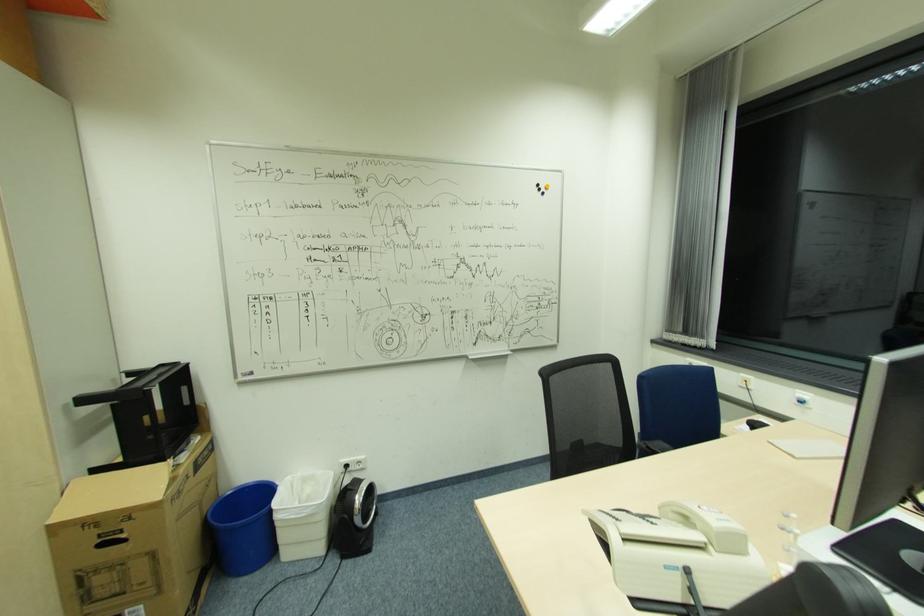
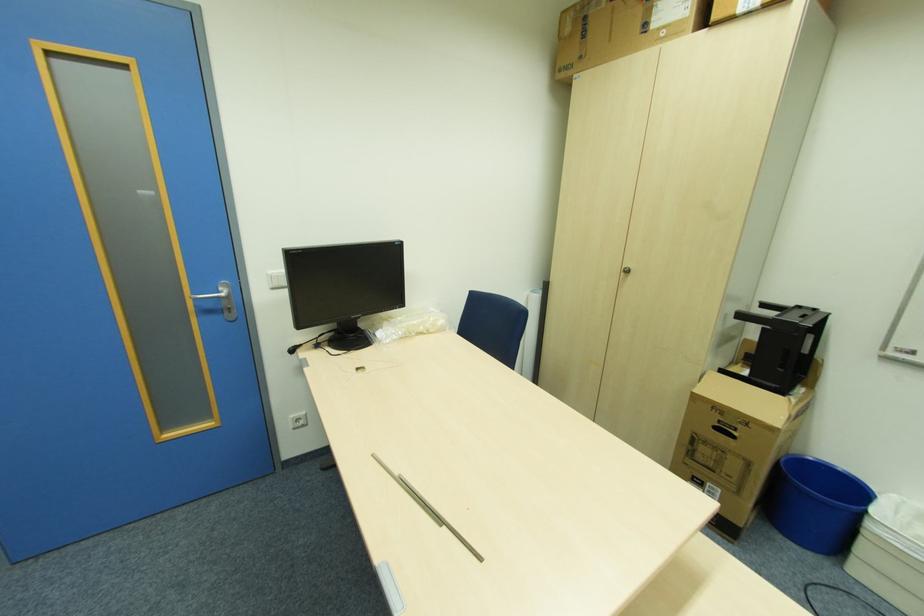
The point at [290,477] is marked in the first image. Where is the corresponding point in the second image?

(896, 496)